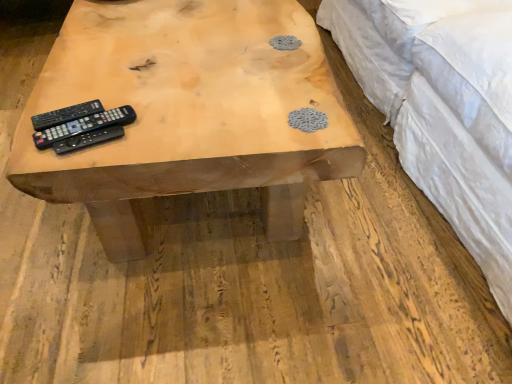
In order to click on free space in front of black matte remote control at left, which is the first remote control from back to front in this screenshot , I will do `click(56, 151)`.